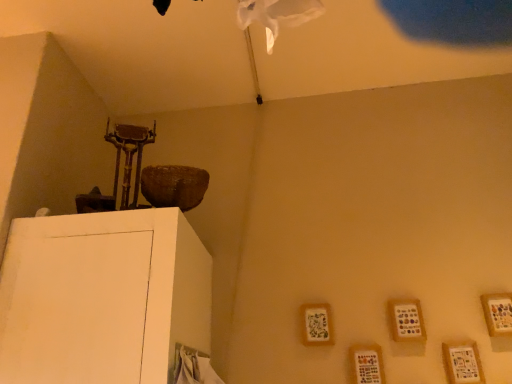
Question: Should I look upward or downward to see wooden frame at lower right, positioned as the 1th picture frame in left-to-right order?

Choices:
 (A) down
 (B) up

Answer: (A)

Question: Should I look upward or downward to see wooden frame at lower right, positioned as the third picture frame in left-to-right order?

Choices:
 (A) up
 (B) down

Answer: (B)

Question: Can you confirm if wooden frame at lower right, which is the 4th picture frame from left to right, is bigger than wooden frame at lower right, which appears as the 5th picture frame when viewed from the right?

Choices:
 (A) yes
 (B) no

Answer: (A)

Question: Is wooden frame at lower right, positioned as the 1th picture frame in left-to-right order, located within wooden frame at lower right, arranged as the second picture frame when viewed from the right?

Choices:
 (A) yes
 (B) no

Answer: (B)

Question: From the image's perspective, is wooden frame at lower right, arranged as the second picture frame when viewed from the right, over wooden frame at lower right, which appears as the 5th picture frame when viewed from the right?

Choices:
 (A) yes
 (B) no

Answer: (B)

Question: Is the depth of wooden frame at lower right, which is the 4th picture frame from left to right, greater than that of wooden frame at lower right, positioned as the 1th picture frame in left-to-right order?

Choices:
 (A) yes
 (B) no

Answer: (B)

Question: Is wooden frame at lower right, which is the 4th picture frame from left to right, to the right of wooden frame at lower right, positioned as the 1th picture frame in left-to-right order, from the viewer's perspective?

Choices:
 (A) no
 (B) yes

Answer: (B)

Question: Considering the relative sizes of wooden frame at lower right, which is the 4th picture frame from left to right, and wooden frame at lower right, which appears as the 5th picture frame when viewed from the right, in the image provided, is wooden frame at lower right, which is the 4th picture frame from left to right, shorter than wooden frame at lower right, which appears as the 5th picture frame when viewed from the right,?

Choices:
 (A) no
 (B) yes

Answer: (B)

Question: Considering the relative positions of wooden frame at lower right, positioned as the third picture frame in left-to-right order, and wooden frame at lower right, which appears as the 5th picture frame when viewed from the right, in the image provided, is wooden frame at lower right, positioned as the third picture frame in left-to-right order, behind wooden frame at lower right, which appears as the 5th picture frame when viewed from the right,?

Choices:
 (A) yes
 (B) no

Answer: (B)

Question: Is wooden frame at lower right, positioned as the third picture frame in left-to-right order, aimed at wooden frame at lower right, positioned as the 1th picture frame in left-to-right order?

Choices:
 (A) no
 (B) yes

Answer: (A)

Question: Considering the relative sizes of wooden frame at lower right, positioned as the third picture frame in left-to-right order, and wooden frame at lower right, positioned as the 1th picture frame in left-to-right order, in the image provided, is wooden frame at lower right, positioned as the third picture frame in left-to-right order, wider than wooden frame at lower right, positioned as the 1th picture frame in left-to-right order,?

Choices:
 (A) no
 (B) yes

Answer: (B)

Question: Is wooden frame at lower right, which appears as the 3th picture frame when viewed from the right, positioned with its back to wooden frame at lower right, positioned as the 1th picture frame in left-to-right order?

Choices:
 (A) yes
 (B) no

Answer: (B)

Question: Does wooden frame at lower right, which appears as the 3th picture frame when viewed from the right, have a smaller size compared to wooden frame at lower right, positioned as the 1th picture frame in left-to-right order?

Choices:
 (A) yes
 (B) no

Answer: (B)

Question: Is wooden frame at lower right, which appears as the 5th picture frame when viewed from the right, a part of wooden frame at lower right, positioned as the third picture frame in left-to-right order?

Choices:
 (A) yes
 (B) no

Answer: (B)

Question: Can you confirm if wooden frame at lower right, positioned as the third picture frame in left-to-right order, is shorter than wooden picture frame at lower right, arranged as the fourth picture frame when viewed from the right?

Choices:
 (A) no
 (B) yes

Answer: (A)